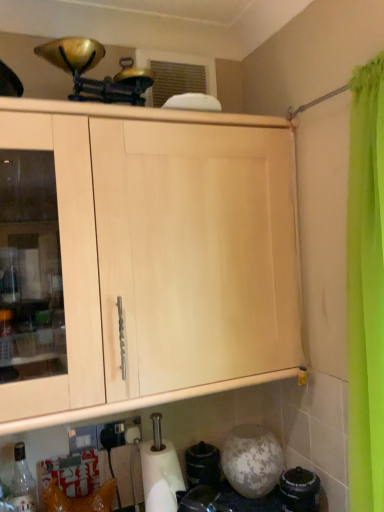
The width and height of the screenshot is (384, 512). What do you see at coordinates (22, 483) in the screenshot? I see `translucent glass bottle at lower left` at bounding box center [22, 483].

Where is `translucent glass bottle at lower left`? Image resolution: width=384 pixels, height=512 pixels. translucent glass bottle at lower left is located at coordinates (22, 483).

Measure the distance between point (141, 444) and camera.

The depth of point (141, 444) is 1.37 meters.

This screenshot has width=384, height=512. Describe the element at coordinates (160, 476) in the screenshot. I see `white matte paper towel at lower center` at that location.

At what (x,y) coordinates should I click in order to perform the action: click on white matte paper towel at lower center. Please return your answer as a coordinate pair (x, y). Looking at the image, I should click on (160, 476).

The width and height of the screenshot is (384, 512). In order to click on translucent glass bottle at lower left in this screenshot , I will do [22, 483].

Considering the relative positions of white matte paper towel at lower center and translucent glass bottle at lower left in the image provided, is white matte paper towel at lower center to the right of translucent glass bottle at lower left from the viewer's perspective?

Indeed, white matte paper towel at lower center is positioned on the right side of translucent glass bottle at lower left.

Is white matte paper towel at lower center behind translucent glass bottle at lower left?

Yes, it is behind translucent glass bottle at lower left.

Considering the positions of point (149, 483) and point (24, 483), is point (149, 483) closer or farther from the camera than point (24, 483)?

Point (149, 483) appears to be farther away from the viewer than point (24, 483).

From the image's perspective, between white matte paper towel at lower center and translucent glass bottle at lower left, which one is located above?

white matte paper towel at lower center.

From a real-world perspective, which is physically above, white matte paper towel at lower center or translucent glass bottle at lower left?

white matte paper towel at lower center is physically above.

Is white matte paper towel at lower center wider than translucent glass bottle at lower left?

Yes.

Does white matte paper towel at lower center have a lesser height compared to translucent glass bottle at lower left?

In fact, white matte paper towel at lower center may be taller than translucent glass bottle at lower left.

Does white matte paper towel at lower center have a larger size compared to translucent glass bottle at lower left?

Yes.

Is white matte paper towel at lower center not within translucent glass bottle at lower left?

Yes, white matte paper towel at lower center is not within translucent glass bottle at lower left.

Would you say white matte paper towel at lower center is a long distance from translucent glass bottle at lower left?

Actually, white matte paper towel at lower center and translucent glass bottle at lower left are a little close together.

Is white matte paper towel at lower center looking in the opposite direction of translucent glass bottle at lower left?

No, translucent glass bottle at lower left is not at the back of white matte paper towel at lower center.

What's the angular difference between white matte paper towel at lower center and translucent glass bottle at lower left's facing directions?

There is a 3.68-degree angle between the facing directions of white matte paper towel at lower center and translucent glass bottle at lower left.

Locate an element on the screen. The width and height of the screenshot is (384, 512). bottle below the white matte paper towel at lower center (from the image's perspective) is located at coordinates (22, 483).

Is translucent glass bottle at lower left at the right side of white matte paper towel at lower center?

No, translucent glass bottle at lower left is not to the right of white matte paper towel at lower center.

Which object is closer to the camera, translucent glass bottle at lower left or white matte paper towel at lower center?

translucent glass bottle at lower left is closer to the camera.

Which is closer, (17,457) or (168,441)?

Point (17,457) is closer to the camera than point (168,441).

From the image's perspective, who appears lower, translucent glass bottle at lower left or white matte paper towel at lower center?

translucent glass bottle at lower left.

From a real-world perspective, which is physically below, translucent glass bottle at lower left or white matte paper towel at lower center?

translucent glass bottle at lower left.

Looking at their sizes, would you say translucent glass bottle at lower left is wider or thinner than white matte paper towel at lower center?

Considering their sizes, translucent glass bottle at lower left looks slimmer than white matte paper towel at lower center.

Between translucent glass bottle at lower left and white matte paper towel at lower center, which one has more height?

Standing taller between the two is white matte paper towel at lower center.

Considering the sizes of objects translucent glass bottle at lower left and white matte paper towel at lower center in the image provided, who is smaller, translucent glass bottle at lower left or white matte paper towel at lower center?

With smaller size is translucent glass bottle at lower left.

Is white matte paper towel at lower center surrounded by translucent glass bottle at lower left?

No.

In the scene shown: Is translucent glass bottle at lower left next to white matte paper towel at lower center and touching it?

No, translucent glass bottle at lower left is not beside white matte paper towel at lower center.

Is translucent glass bottle at lower left oriented towards white matte paper towel at lower center?

No, translucent glass bottle at lower left does not turn towards white matte paper towel at lower center.

How different are the orientations of translucent glass bottle at lower left and white matte paper towel at lower center in degrees?

The angular difference between translucent glass bottle at lower left and white matte paper towel at lower center is 3.68 degrees.

Based on the photo, measure the distance between translucent glass bottle at lower left and white matte paper towel at lower center.

They are 36.85 centimeters apart.

Where is `bottle on the left of white matte paper towel at lower center`? The image size is (384, 512). bottle on the left of white matte paper towel at lower center is located at coordinates (22, 483).

What are the coordinates of `bottle in front of the white matte paper towel at lower center` in the screenshot? It's located at (22, 483).

Locate an element on the screen. The width and height of the screenshot is (384, 512). bottle lying on the left of white matte paper towel at lower center is located at coordinates (22, 483).